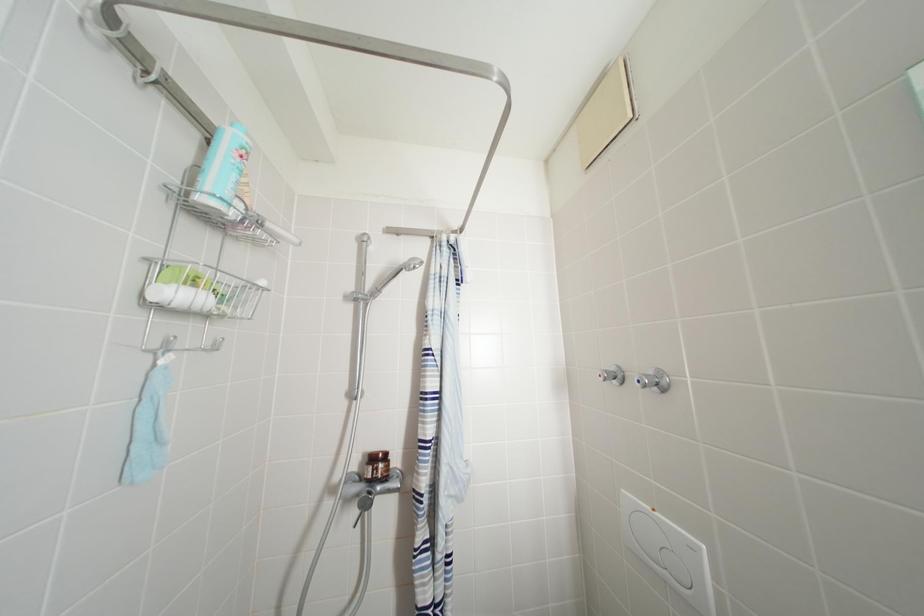
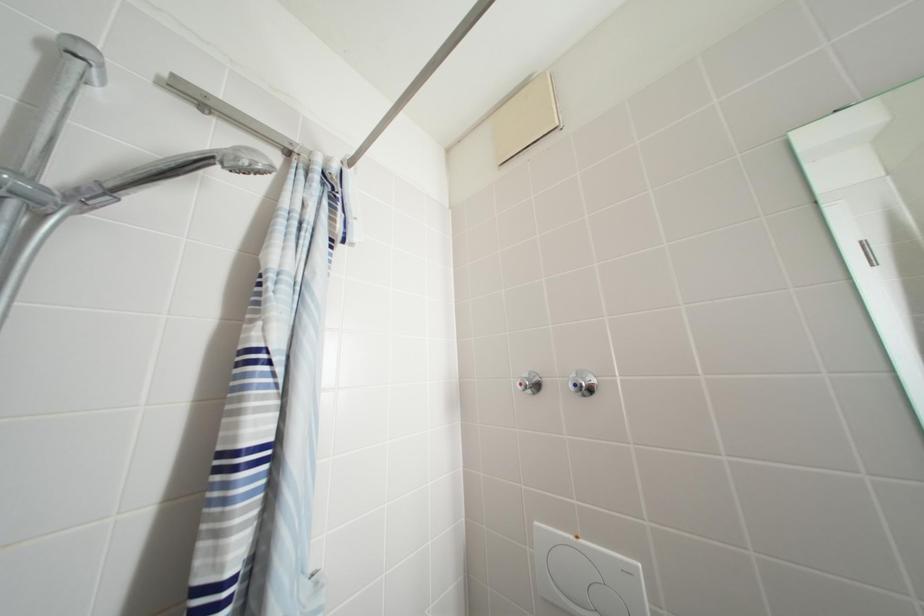
Question: The camera is either moving clockwise (left) or counter-clockwise (right) around the object. The first image is from the beginning of the video and the second image is from the end. Is the camera moving left or right when shooting the video?

Choices:
 (A) Left
 (B) Right

Answer: (A)